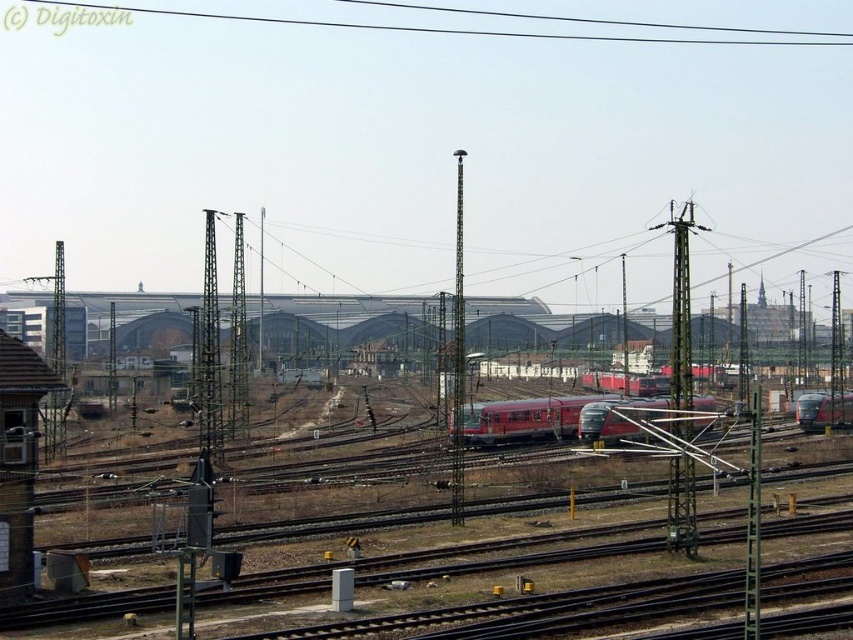
You are standing at the point with coordinates point (809, 428) and want to walk towards the point with coordinates point (198, 13). Which direction should you face to walk directly towards it?

Since point (198, 13) is behind point (809, 428), you should face north to walk directly towards it.

You are a railway engineer inspecting the scene. You notice the red metallic train at center and the black wire at upper center. Which object is positioned closer to your current viewpoint?

The red metallic train at center is closer to the viewer than the black wire at upper center.